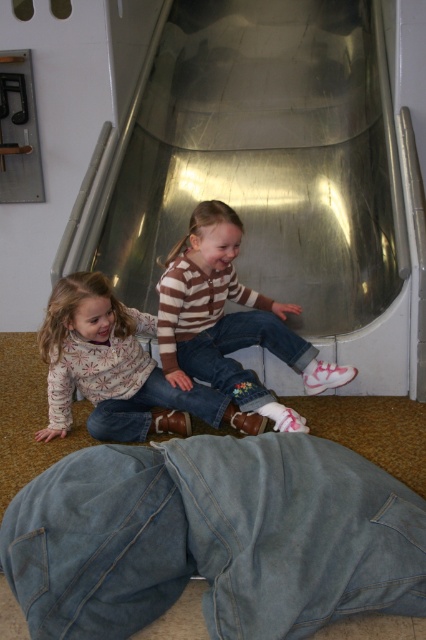
Which is more to the right, denim pants at lower center or striped sweater at center?

From the viewer's perspective, striped sweater at center appears more on the right side.

Does point (58, 618) come behind point (261, 333)?

No, (58, 618) is closer to viewer.

Find the location of a particular element. The height and width of the screenshot is (640, 426). denim pants at lower center is located at coordinates (213, 538).

You are a GUI agent. You are given a task and a screenshot of the screen. Output one action in this format:
    pyautogui.click(x=<x>, y=<y>)
    Task: Click on the denim pants at lower center
    
    Given the screenshot: What is the action you would take?
    pyautogui.click(x=213, y=538)

Does denim pants at lower center appear on the right side of floral-patterned sweater at lower left?

Indeed, denim pants at lower center is positioned on the right side of floral-patterned sweater at lower left.

Describe the element at coordinates (213, 538) in the screenshot. I see `denim pants at lower center` at that location.

What are the coordinates of `denim pants at lower center` in the screenshot? It's located at tap(213, 538).

Can you confirm if striped sweater at center is bigger than floral-patterned sweater at lower left?

Correct, striped sweater at center is larger in size than floral-patterned sweater at lower left.

Which of these two, striped sweater at center or floral-patterned sweater at lower left, stands taller?

striped sweater at center is taller.

Is point (241, 317) closer to viewer compared to point (89, 356)?

No, it is not.

At what (x,y) coordinates should I click in order to perform the action: click on striped sweater at center. Please return your answer as a coordinate pair (x, y). The image size is (426, 640). Looking at the image, I should click on (229, 321).